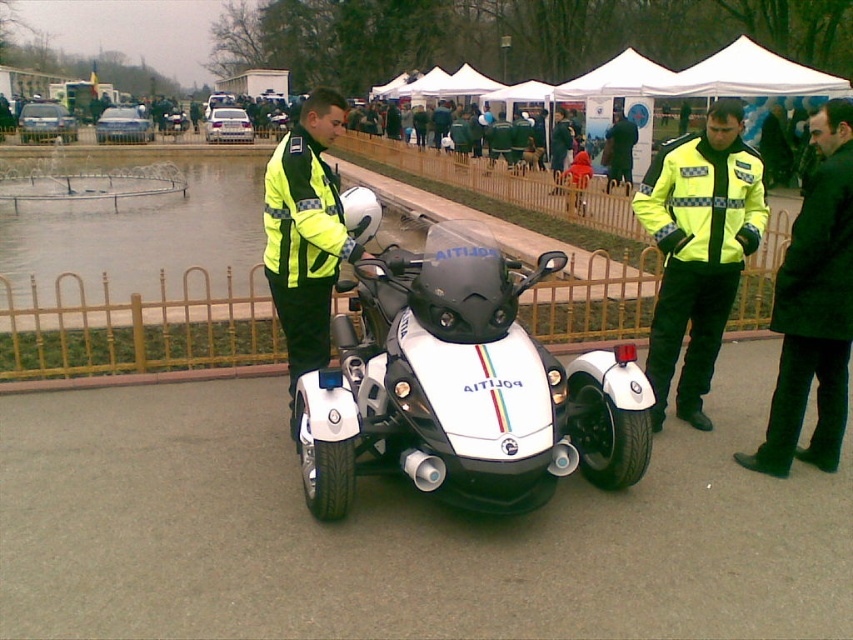
You are a delivery person who needs to park your 1.2 meter wide electric scooter in this area. There is a white glossy trike at center and a black leather jacket at right. Can you fit your scooter between them without touching either?

The white glossy trike at center might be wider than black leather jacket at right, so there might not be enough space to fit your 1.2 meter wide electric scooter between them without touching either.

You are a pedestrian who wants to cross the street safely. You notice two officers in the scene, one wearing a yellow reflective jacket at center and another in a black leather jacket at right. Which officer should you look towards first to check if it is safe to cross?

The yellow reflective jacket at center is much taller than the black leather jacket at right, so it would be more visible from a distance. Therefore, you should look towards the yellow reflective jacket at center first to check if it is safe to cross.